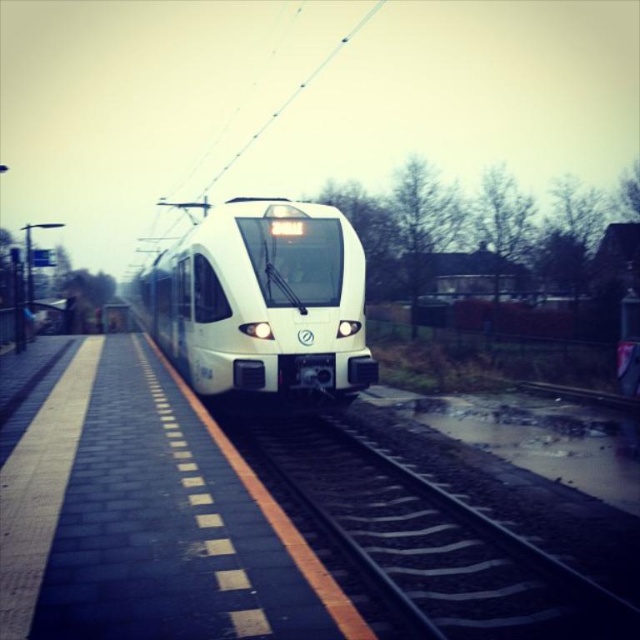
In the scene shown: You are a maintenance worker checking the train tracks. You see the black metal train track at center and the white glossy train at center. Which object is positioned lower from the ground?

The black metal train track at center is located below the white glossy train at center, so the black metal train track at center is positioned lower from the ground.

You are standing on the platform of the modern electric train station. You notice two points marked on the platform. The first point is at coordinate point (371, 538) and the second is at coordinate point (317, 308). Which point is closer to you?

Point (371, 538) is closer to the viewer than point (317, 308).

You are a passenger waiting at the station and see the black metal train track at center and the white glossy train at center. Which object appears larger in the image?

The white glossy train at center appears larger than the black metal train track at center in the image.